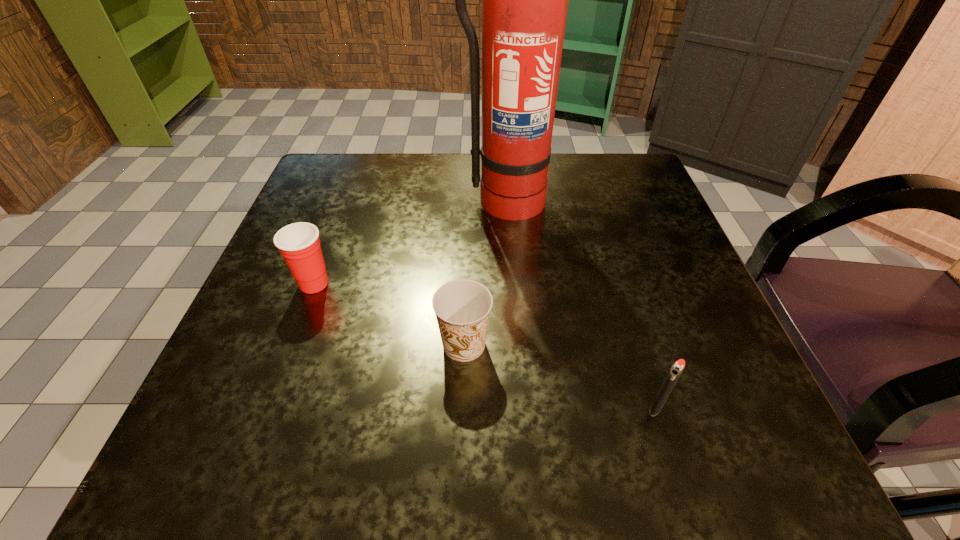
Identify the location of free location located on the right of the nearest object. (719, 407).

You are a GUI agent. You are given a task and a screenshot of the screen. Output one action in this format:
    pyautogui.click(x=<x>, y=<y>)
    Task: Click on the free space located on the right of the second nearest object
    
    Given the screenshot: What is the action you would take?
    pyautogui.click(x=700, y=345)

Find the location of a particular element. The width and height of the screenshot is (960, 540). object at the far edge is located at coordinates click(x=524, y=0).

Identify the location of object at the near edge. The height and width of the screenshot is (540, 960). pyautogui.click(x=676, y=370).

At what (x,y) coordinates should I click in order to perform the action: click on object located at the left edge. Please return your answer as a coordinate pair (x, y). Image resolution: width=960 pixels, height=540 pixels. Looking at the image, I should click on (299, 244).

Identify the location of object present at the right edge. The width and height of the screenshot is (960, 540). (676, 370).

Image resolution: width=960 pixels, height=540 pixels. I want to click on object present at the near right corner, so click(x=676, y=370).

At what (x,y) coordinates should I click in order to perform the action: click on free region at the far edge. Please return your answer as a coordinate pair (x, y). Looking at the image, I should click on 454,195.

Identify the location of free space at the near edge of the desktop. The width and height of the screenshot is (960, 540). tap(402, 441).

In the image, there is a desktop. Where is `free space at the left edge`? The image size is (960, 540). free space at the left edge is located at coordinates (318, 225).